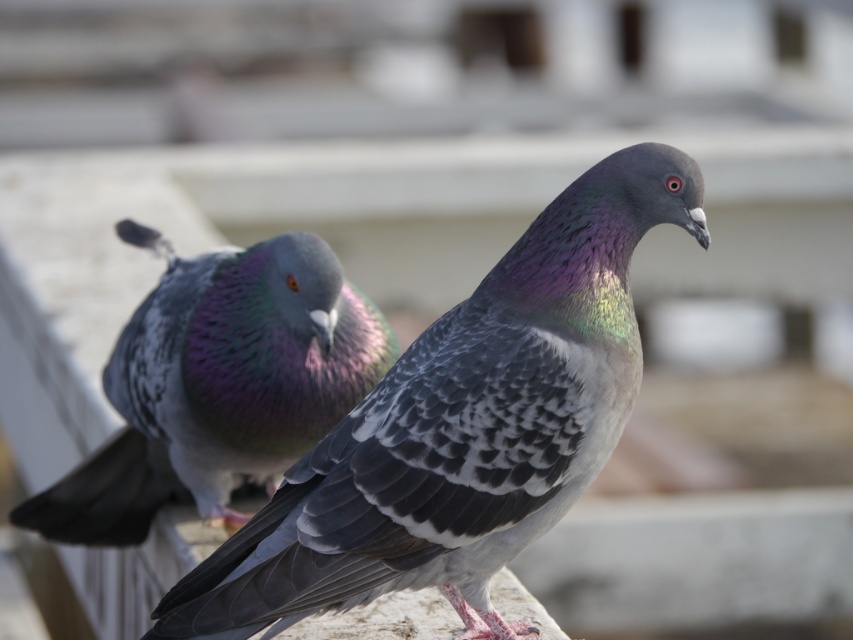
Does shiny iridescent pigeon at center have a lesser width compared to shiny iridescent feathers at center?

Correct, shiny iridescent pigeon at center's width is less than shiny iridescent feathers at center's.

Can you confirm if shiny iridescent pigeon at center is positioned to the left of shiny iridescent feathers at center?

Incorrect, shiny iridescent pigeon at center is not on the left side of shiny iridescent feathers at center.

The image size is (853, 640). What do you see at coordinates (461, 428) in the screenshot?
I see `shiny iridescent pigeon at center` at bounding box center [461, 428].

The image size is (853, 640). I want to click on shiny iridescent pigeon at center, so click(461, 428).